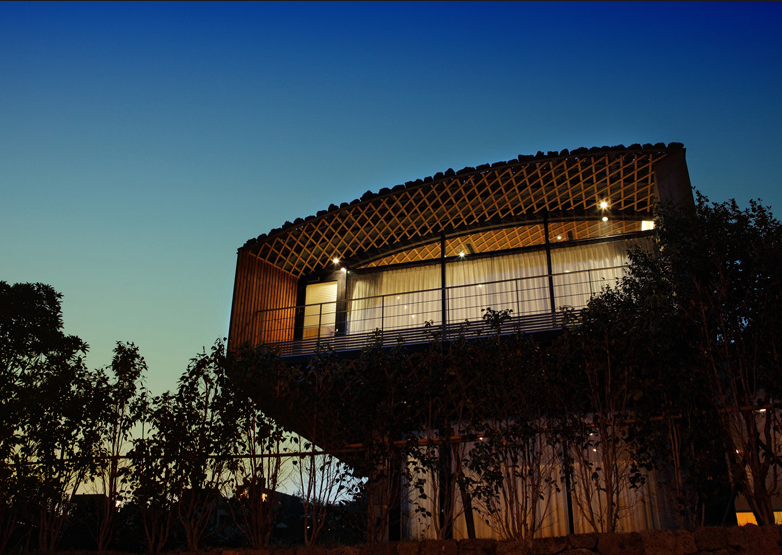
The image size is (782, 555). Find the location of `light`. light is located at coordinates (336, 263), (607, 201), (604, 220), (558, 241), (461, 255).